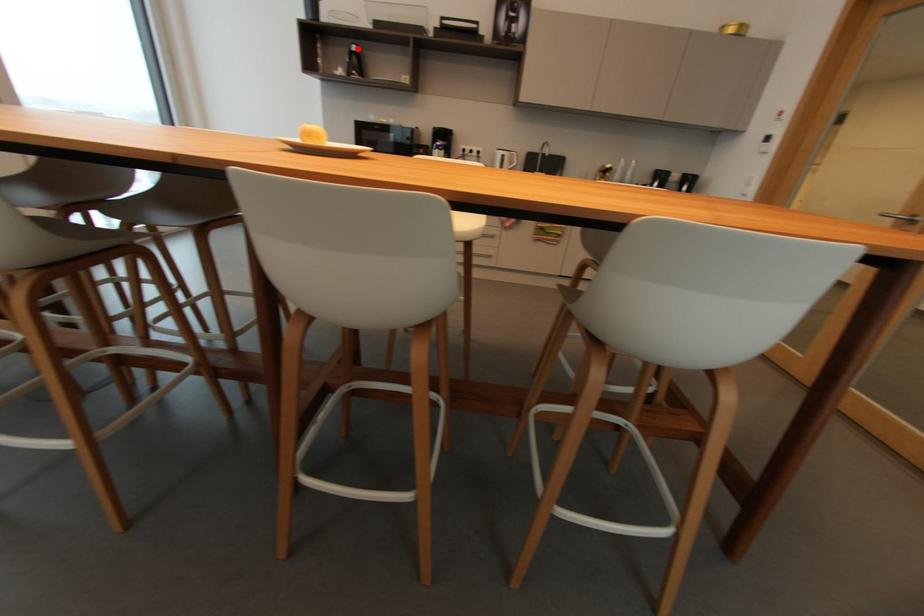
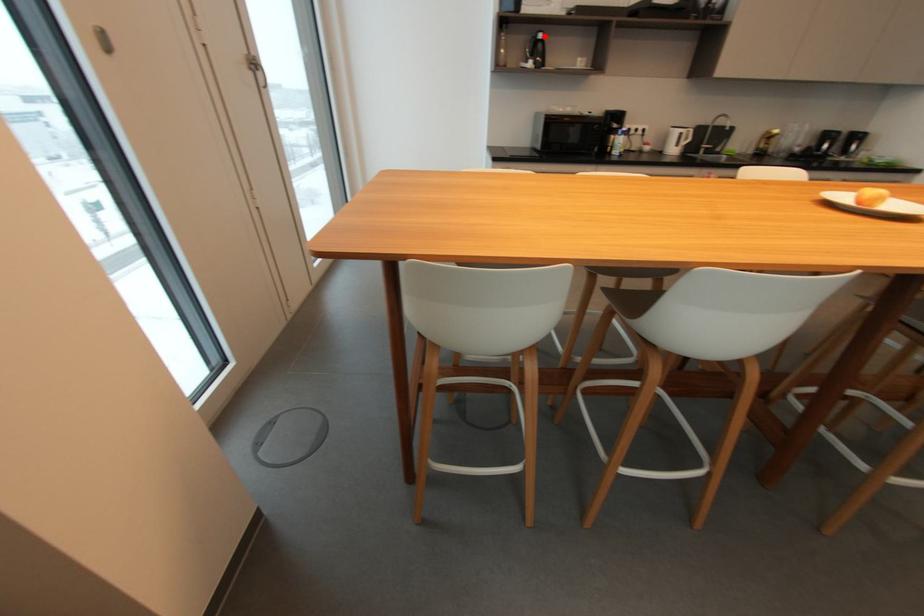
Looking at this image, I am providing you with two images of the same scene from different viewpoints. A red point is marked on the first image and another point is marked on the second image. Is the red point in image1 aligned with the point shown in image2?

Yes